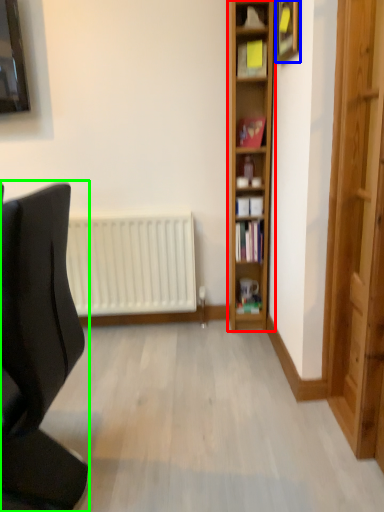
Question: Which object is positioned closest to shelf (highlighted by a red box)? Select from picture frame (highlighted by a blue box) and chair (highlighted by a green box).

Choices:
 (A) picture frame
 (B) chair

Answer: (A)